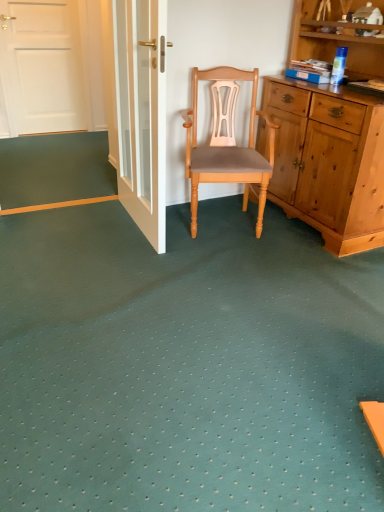
Question: From a real-world perspective, relative to white glossy door at upper center, is light brown wood chair at center vertically above or below?

Choices:
 (A) below
 (B) above

Answer: (A)

Question: Does point tap(216, 119) appear closer or farther from the camera than point tap(125, 0)?

Choices:
 (A) farther
 (B) closer

Answer: (A)

Question: Considering the real-world distances, which object is closest to the white glossy door at upper center?

Choices:
 (A) orange matte strip at lower left
 (B) light brown wood chair at center

Answer: (B)

Question: Based on their relative distances, which object is nearer to the orange matte strip at lower left?

Choices:
 (A) light brown wood chair at center
 (B) white glossy door at upper center

Answer: (B)